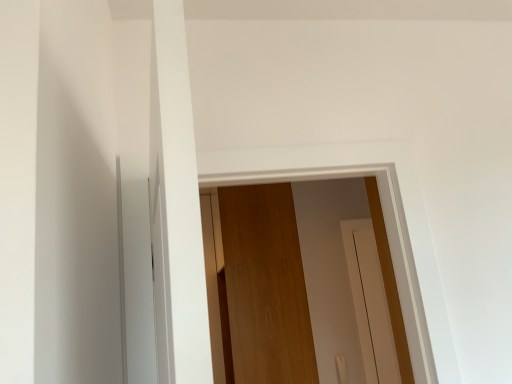
The image size is (512, 384). What do you see at coordinates (370, 303) in the screenshot? I see `wooden screen door at center` at bounding box center [370, 303].

I want to click on wooden screen door at center, so click(x=370, y=303).

Measure the distance between wooden door at center and camera.

The depth of wooden door at center is 2.76 meters.

Image resolution: width=512 pixels, height=384 pixels. Describe the element at coordinates (266, 286) in the screenshot. I see `wooden door at center` at that location.

What is the approximate width of wooden door at center?

wooden door at center is 90.86 centimeters in width.

Find the location of a particular element. This screenshot has height=384, width=512. wooden door at center is located at coordinates (266, 286).

Find the location of a particular element. The width and height of the screenshot is (512, 384). wooden screen door at center is located at coordinates (370, 303).

Is wooden screen door at center to the left of wooden door at center from the viewer's perspective?

No, wooden screen door at center is not to the left of wooden door at center.

Considering their positions, is wooden screen door at center located in front of or behind wooden door at center?

wooden screen door at center is behind wooden door at center.

Which is closer, (354,290) or (252,257)?

The point (252,257) is more forward.

From the image's perspective, between wooden screen door at center and wooden door at center, who is located below?

From the image's view, wooden screen door at center is below.

From a real-world perspective, is wooden screen door at center above or below wooden door at center?

Clearly, from a real-world perspective, wooden screen door at center is below wooden door at center.

Considering the sizes of objects wooden screen door at center and wooden door at center in the image provided, who is wider, wooden screen door at center or wooden door at center?

With larger width is wooden door at center.

Considering the sizes of objects wooden screen door at center and wooden door at center in the image provided, who is taller, wooden screen door at center or wooden door at center?

Standing taller between the two is wooden door at center.

Looking at this image, which of these two, wooden screen door at center or wooden door at center, is bigger?

With larger size is wooden door at center.

Which is correct: wooden screen door at center is inside wooden door at center, or outside of it?

wooden screen door at center is outside wooden door at center.

Are wooden screen door at center and wooden door at center located far from each other?

No, wooden screen door at center is not far away from wooden door at center.

Is wooden screen door at center oriented away from wooden door at center?

wooden screen door at center does not have its back to wooden door at center.

Consider the image. Measure the distance between wooden screen door at center and wooden door at center.

wooden screen door at center and wooden door at center are 21.55 inches apart from each other.

What are the coordinates of `door above the wooden screen door at center (from a real-world perspective)` in the screenshot? It's located at (266, 286).

Between wooden door at center and wooden screen door at center, which one appears on the left side from the viewer's perspective?

From the viewer's perspective, wooden door at center appears more on the left side.

Relative to wooden screen door at center, is wooden door at center in front or behind?

wooden door at center is positioned closer to the viewer than wooden screen door at center.

Between point (253, 335) and point (368, 233), which one is positioned in front?

The point (253, 335) is in front.

From the image's perspective, is wooden door at center located beneath wooden screen door at center?

Actually, wooden door at center appears above wooden screen door at center in the image.

From a real-world perspective, is wooden door at center located higher than wooden screen door at center?

Yes, from a real-world perspective, wooden door at center is above wooden screen door at center.

Between wooden door at center and wooden screen door at center, which one has smaller width?

Thinner between the two is wooden screen door at center.

Is wooden door at center taller or shorter than wooden screen door at center?

In the image, wooden door at center appears to be taller than wooden screen door at center.

Who is bigger, wooden door at center or wooden screen door at center?

Bigger between the two is wooden door at center.

Could wooden screen door at center be considered to be inside wooden door at center?

Actually, wooden screen door at center is outside wooden door at center.

Are wooden door at center and wooden screen door at center far apart?

No, wooden door at center is not far away from wooden screen door at center.

Could you tell me if wooden door at center is facing wooden screen door at center?

No.

Find the location of `door above the wooden screen door at center (from the image's perspective)`. door above the wooden screen door at center (from the image's perspective) is located at coordinates (266, 286).

Find the location of a particular element. door above the wooden screen door at center (from a real-world perspective) is located at coordinates (266, 286).

The image size is (512, 384). I want to click on screen door on the right of wooden door at center, so click(370, 303).